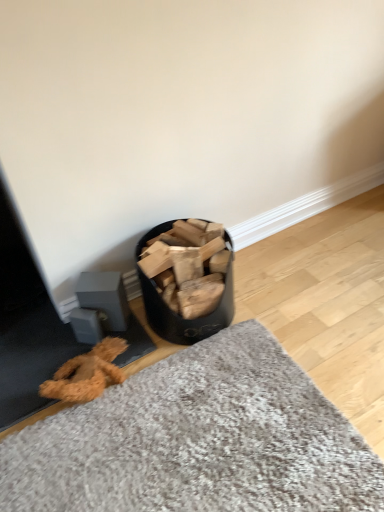
In order to click on black matte wood at center in this screenshot , I will do `click(181, 316)`.

What do you see at coordinates (181, 316) in the screenshot? Image resolution: width=384 pixels, height=512 pixels. I see `black matte wood at center` at bounding box center [181, 316].

This screenshot has height=512, width=384. What do you see at coordinates (198, 441) in the screenshot? I see `textured gray mat at lower center` at bounding box center [198, 441].

Locate an element on the screen. The height and width of the screenshot is (512, 384). textured gray mat at lower center is located at coordinates (198, 441).

Where is `black matte wood at center`? The width and height of the screenshot is (384, 512). black matte wood at center is located at coordinates (181, 316).

Is black matte wood at center at the right side of textured gray mat at lower center?

In fact, black matte wood at center is to the left of textured gray mat at lower center.

From the picture: Which object is more forward, black matte wood at center or textured gray mat at lower center?

textured gray mat at lower center.

Which is behind, point (149, 287) or point (303, 457)?

The point (149, 287) is farther.

From the image's perspective, is black matte wood at center located above textured gray mat at lower center?

Yes.

From a real-world perspective, which object rests below the other?

In real-world perspective, textured gray mat at lower center is lower.

In terms of width, does black matte wood at center look wider or thinner when compared to textured gray mat at lower center?

In the image, black matte wood at center appears to be more narrow than textured gray mat at lower center.

Based on the photo, between black matte wood at center and textured gray mat at lower center, which one has more height?

With more height is black matte wood at center.

Considering the relative sizes of black matte wood at center and textured gray mat at lower center in the image provided, is black matte wood at center bigger than textured gray mat at lower center?

Incorrect, black matte wood at center is not larger than textured gray mat at lower center.

Looking at this image, can we say black matte wood at center lies outside textured gray mat at lower center?

Yes, black matte wood at center is outside of textured gray mat at lower center.

Based on the photo, does black matte wood at center touch textured gray mat at lower center?

black matte wood at center is not next to textured gray mat at lower center, and they're not touching.

Could you tell me if black matte wood at center is facing textured gray mat at lower center?

No, black matte wood at center does not turn towards textured gray mat at lower center.

How many degrees apart are the facing directions of black matte wood at center and textured gray mat at lower center?

The facing directions of black matte wood at center and textured gray mat at lower center are 178 degrees apart.

Locate an element on the screen. mat below the black matte wood at center (from a real-world perspective) is located at coordinates (198, 441).

In the image, is textured gray mat at lower center on the left side or the right side of black matte wood at center?

From the image, it's evident that textured gray mat at lower center is to the right of black matte wood at center.

Who is more distant, textured gray mat at lower center or black matte wood at center?

black matte wood at center.

Which is farther from the camera, (99, 509) or (163, 337)?

Point (163, 337)

Consider the image. From the image's perspective, relative to black matte wood at center, is textured gray mat at lower center above or below?

textured gray mat at lower center is situated lower than black matte wood at center in the image.

From a real-world perspective, does textured gray mat at lower center sit lower than black matte wood at center?

Correct, in the physical world, textured gray mat at lower center is lower than black matte wood at center.

Considering the sizes of objects textured gray mat at lower center and black matte wood at center in the image provided, who is wider, textured gray mat at lower center or black matte wood at center?

textured gray mat at lower center.

Is textured gray mat at lower center taller than black matte wood at center?

In fact, textured gray mat at lower center may be shorter than black matte wood at center.

Can you confirm if textured gray mat at lower center is smaller than black matte wood at center?

No.

Can we say textured gray mat at lower center lies outside black matte wood at center?

textured gray mat at lower center lies outside black matte wood at center's area.

Is textured gray mat at lower center not close to black matte wood at center?

No, textured gray mat at lower center is in close proximity to black matte wood at center.

Consider the image. Is textured gray mat at lower center oriented away from black matte wood at center?

That's not correct — textured gray mat at lower center is not looking away from black matte wood at center.

How many degrees apart are the facing directions of textured gray mat at lower center and black matte wood at center?

178 degrees separate the facing orientations of textured gray mat at lower center and black matte wood at center.

This screenshot has width=384, height=512. In order to click on mat in front of the black matte wood at center in this screenshot , I will do (x=198, y=441).

In the image, there is a black matte wood at center. Where is `mat below it (from a real-world perspective)`? The image size is (384, 512). mat below it (from a real-world perspective) is located at coordinates (198, 441).

This screenshot has height=512, width=384. In order to click on mat below the black matte wood at center (from the image's perspective) in this screenshot , I will do `click(198, 441)`.